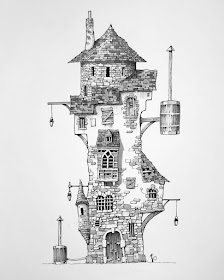
The height and width of the screenshot is (280, 224). What are the coordinates of `window` in the screenshot? It's located at (107, 159).